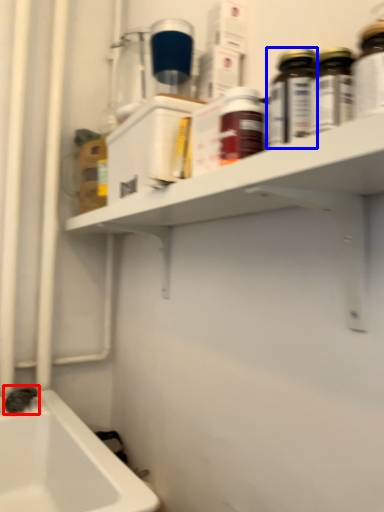
Question: Which of the following is the closest to the observer, plumbing fixture (highlighted by a red box) or bottle (highlighted by a blue box)?

Choices:
 (A) plumbing fixture
 (B) bottle

Answer: (B)